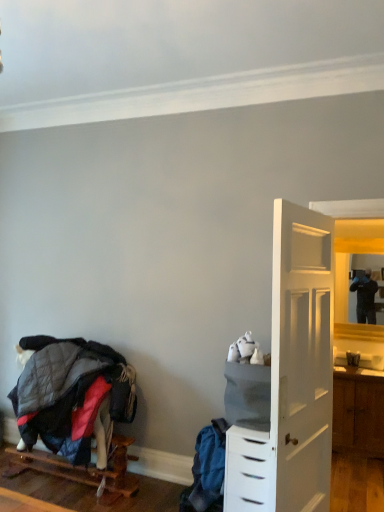
The height and width of the screenshot is (512, 384). Find the location of `free location above matte wooden mirror at right (from a real-world perspective)`. free location above matte wooden mirror at right (from a real-world perspective) is located at coordinates (349, 237).